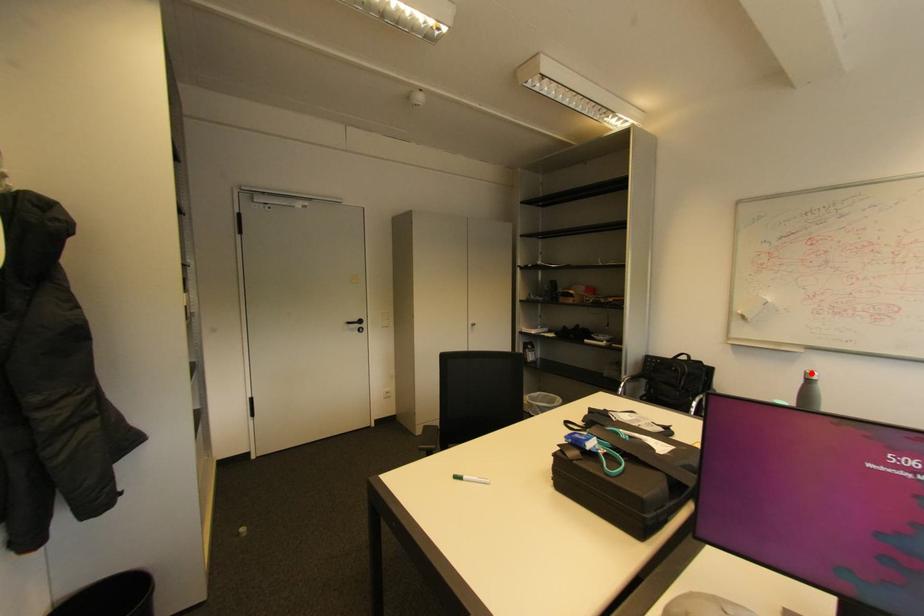
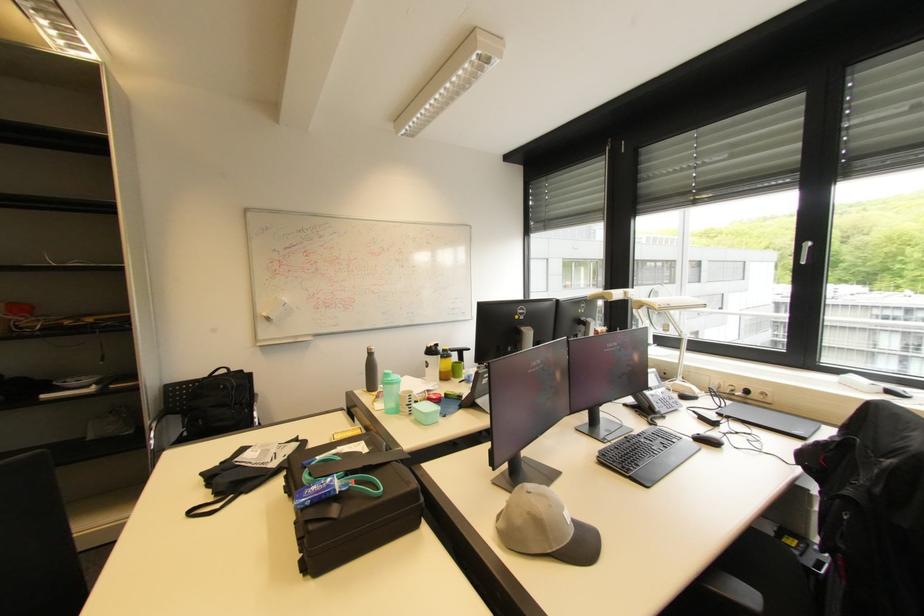
The point at the highlighted location is marked in the first image. Where is the corresponding point in the second image?

(372, 350)